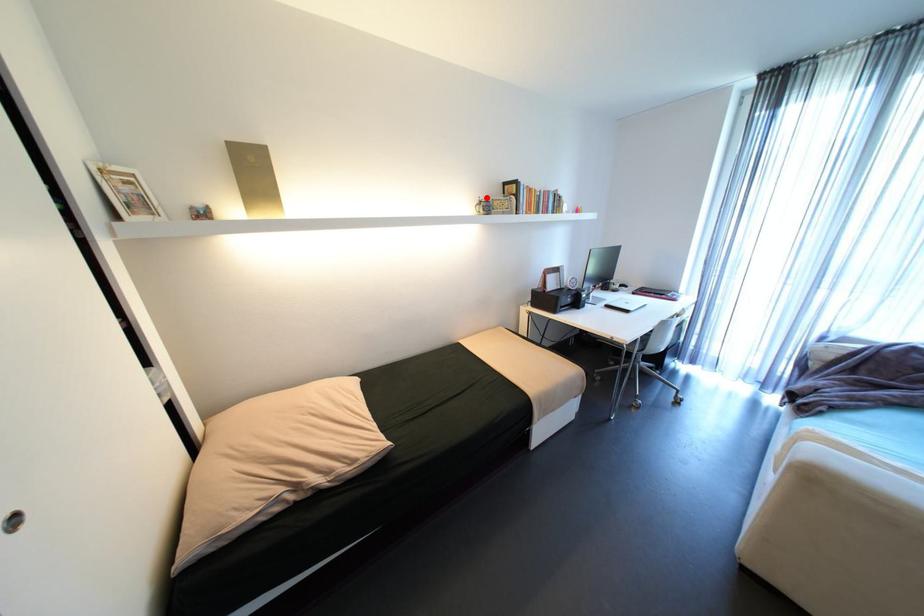
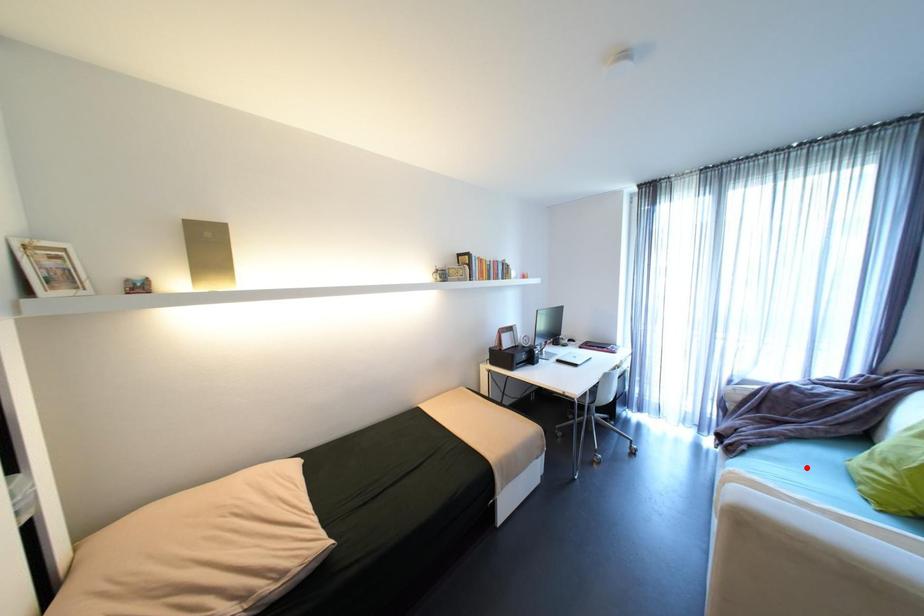
I am providing you with two images of the same scene from different viewpoints. A red point is marked on the first image and another point is marked on the second image. Does the point marked in image1 correspond to the same location as the one in image2?

No